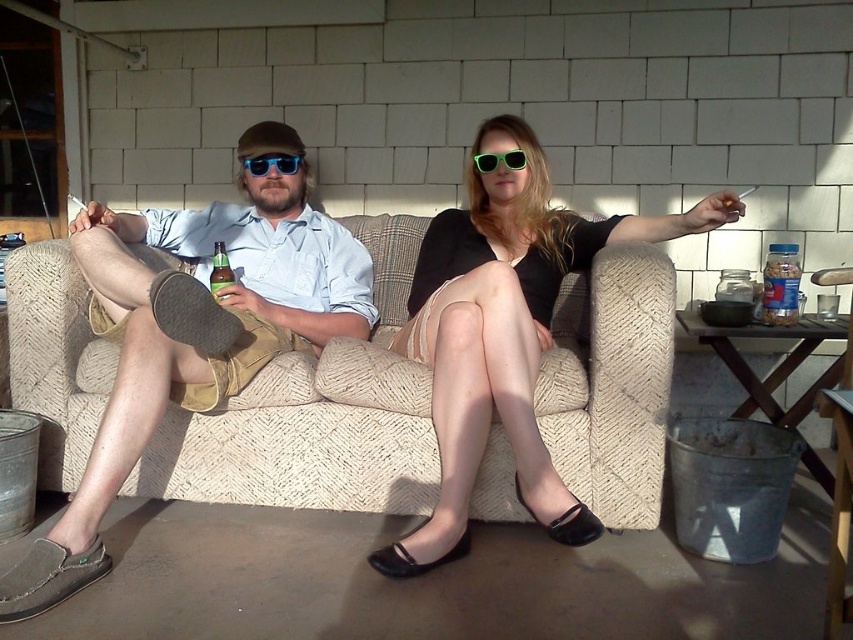
Who is more distant from viewer, (x=592, y=380) or (x=252, y=170)?

Point (x=252, y=170)

Does beige fabric couch at center have a lesser width compared to blue reflective sunglasses at center?

Incorrect, beige fabric couch at center's width is not less than blue reflective sunglasses at center's.

Which is behind, point (270, 387) or point (292, 164)?

Point (292, 164)

Where is `beige fabric couch at center`? Image resolution: width=853 pixels, height=640 pixels. beige fabric couch at center is located at coordinates (316, 417).

Between brown suede shoes at center and blue reflective sunglasses at center, which one is positioned lower?

brown suede shoes at center is lower down.

Which is in front, point (125, 456) or point (260, 170)?

Positioned in front is point (125, 456).

Locate an element on the screen. The height and width of the screenshot is (640, 853). brown suede shoes at center is located at coordinates (192, 332).

Does neon green plastic sunglasses at center appear under green glass bottle at center?

Actually, neon green plastic sunglasses at center is above green glass bottle at center.

Which is in front, point (476, 161) or point (215, 298)?

Positioned in front is point (215, 298).

Between point (490, 161) and point (221, 269), which one is positioned behind?

Positioned behind is point (221, 269).

Locate an element on the screen. This screenshot has width=853, height=640. neon green plastic sunglasses at center is located at coordinates (498, 161).